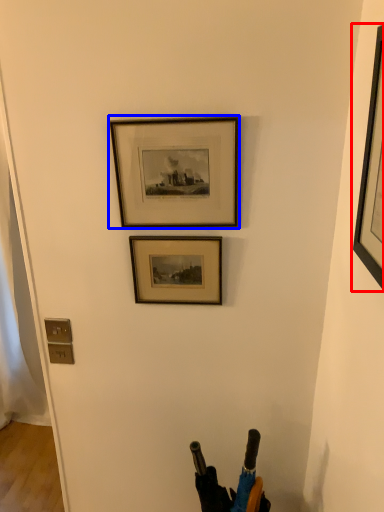
Question: Among these objects, which one is nearest to the camera, picture frame (highlighted by a red box) or picture frame (highlighted by a blue box)?

Choices:
 (A) picture frame
 (B) picture frame

Answer: (A)